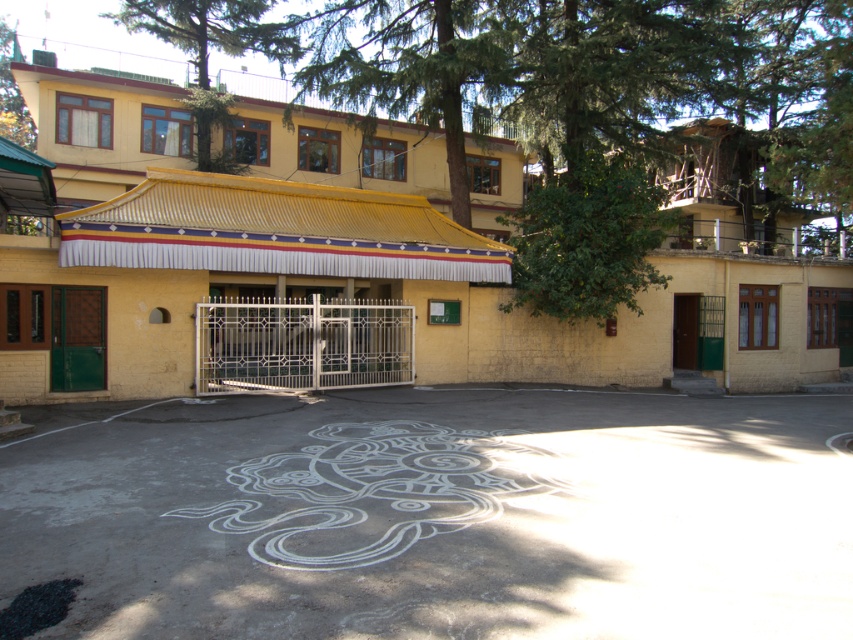
Is point (381, 509) closer to camera compared to point (73, 353)?

Yes, point (381, 509) is closer to viewer.

Is white chalk drawing at center above green wooden door at left?

No.

This screenshot has height=640, width=853. What do you see at coordinates (372, 492) in the screenshot? I see `white chalk drawing at center` at bounding box center [372, 492].

Locate an element on the screen. white chalk drawing at center is located at coordinates (372, 492).

Is green wooden door at left thinner than brown wooden door at center?

No.

Which of these two, green wooden door at left or brown wooden door at center, stands shorter?

green wooden door at left

At what (x,y) coordinates should I click in order to perform the action: click on green wooden door at left. Please return your answer as a coordinate pair (x, y). The width and height of the screenshot is (853, 640). Looking at the image, I should click on (77, 339).

Locate an element on the screen. green wooden door at left is located at coordinates (77, 339).

Can you confirm if white chalk drawing at center is positioned above brown wooden door at center?

No.

At what (x,y) coordinates should I click in order to perform the action: click on white chalk drawing at center. Please return your answer as a coordinate pair (x, y). Image resolution: width=853 pixels, height=640 pixels. Looking at the image, I should click on (372, 492).